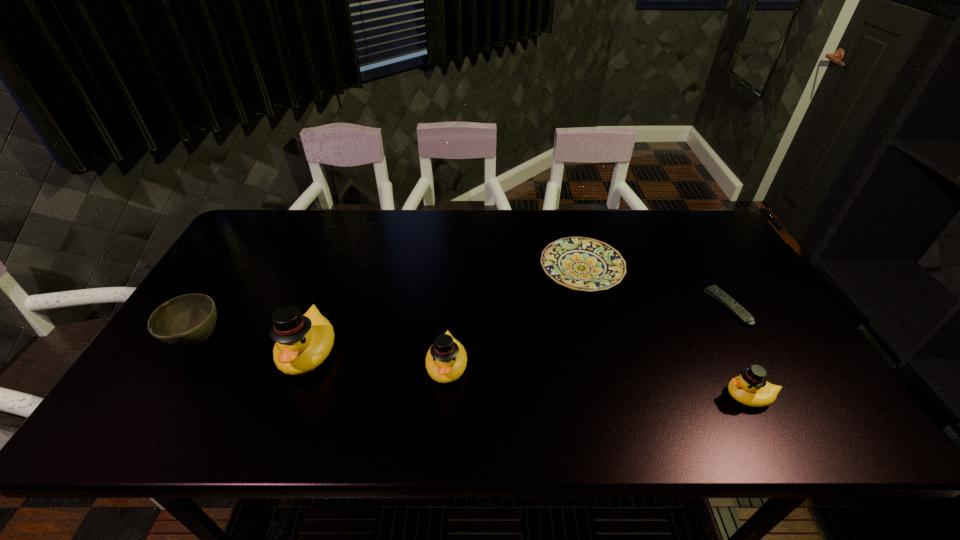
You are a GUI agent. You are given a task and a screenshot of the screen. Output one action in this format:
    pyautogui.click(x=<x>, y=<y>)
    Task: Click on the vacant space in between the tallest duck and the leftmost object
    
    Given the screenshot: What is the action you would take?
    pyautogui.click(x=253, y=346)

Find the location of `unoccupied area between the remote control and the tallest duck`. unoccupied area between the remote control and the tallest duck is located at coordinates (518, 329).

You are a GUI agent. You are given a task and a screenshot of the screen. Output one action in this format:
    pyautogui.click(x=<x>, y=<y>)
    Task: Click on the free space between the rightmost duck and the leftmost duck
    
    Given the screenshot: What is the action you would take?
    pyautogui.click(x=529, y=374)

In order to click on free space between the leftmost object and the fifth object from right to left in this screenshot , I will do `click(253, 346)`.

You are a GUI agent. You are given a task and a screenshot of the screen. Output one action in this format:
    pyautogui.click(x=<x>, y=<y>)
    Task: Click on the vacant area that lies between the fifth shortest object and the fifth tallest object
    
    Given the screenshot: What is the action you would take?
    coord(515,317)

Where is `object that is the fifth closest to the shortest object`? The width and height of the screenshot is (960, 540). object that is the fifth closest to the shortest object is located at coordinates (188, 320).

Identify the location of object that is the closest to the remote control. (750, 388).

Identify which duck is the third nearest to the shortest object. Please provide its 2D coordinates. Your answer should be formatted as a tuple, i.e. [(x, y)], where the tuple contains the x and y coordinates of a point satisfying the conditions above.

[(302, 342)]

Identify which duck is located as the third nearest to the third object from right to left. Please provide its 2D coordinates. Your answer should be formatted as a tuple, i.e. [(x, y)], where the tuple contains the x and y coordinates of a point satisfying the conditions above.

[(302, 342)]